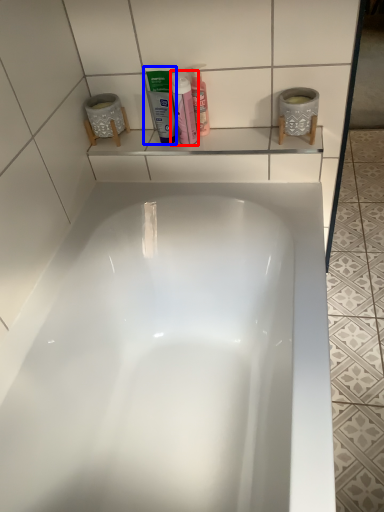
Question: Which point is further to the camera, cleaning product (highlighted by a red box) or mouthwash (highlighted by a blue box)?

Choices:
 (A) cleaning product
 (B) mouthwash

Answer: (B)